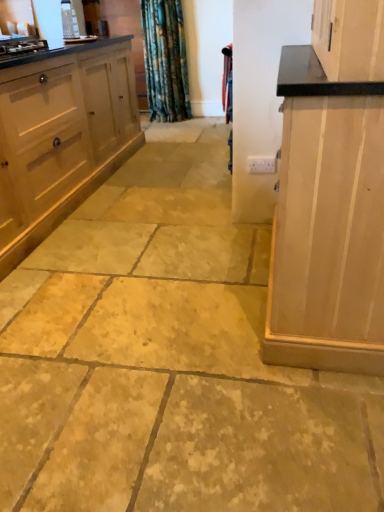
Identify the location of light wood cabinet at right, which ranks as the 1th cabinetry in right-to-left order. (327, 222).

Find the location of `white wood cabinet at left, positioned as the 1th cabinetry in left-to-right order`. white wood cabinet at left, positioned as the 1th cabinetry in left-to-right order is located at coordinates (61, 139).

In order to click on velvet-like red curtain at center in this screenshot , I will do `click(227, 82)`.

Where is `light wood cabinet at right, arranged as the 2th cabinetry when viewed from the left`? This screenshot has width=384, height=512. light wood cabinet at right, arranged as the 2th cabinetry when viewed from the left is located at coordinates (327, 222).

From the image's perspective, relative to white wood cabinet at left, marked as the second cabinetry in a right-to-left arrangement, is velvet-like red curtain at center above or below?

Clearly, from the image's perspective, velvet-like red curtain at center is above white wood cabinet at left, marked as the second cabinetry in a right-to-left arrangement.

From a real-world perspective, who is located higher, velvet-like red curtain at center or white wood cabinet at left, positioned as the 1th cabinetry in left-to-right order?

velvet-like red curtain at center.

Is velvet-like red curtain at center outside of white wood cabinet at left, marked as the second cabinetry in a right-to-left arrangement?

velvet-like red curtain at center lies outside white wood cabinet at left, marked as the second cabinetry in a right-to-left arrangement,'s area.

Considering the points (2, 257) and (229, 77), which point is behind, point (2, 257) or point (229, 77)?

The point (229, 77) is farther.

From a real-world perspective, is white wood cabinet at left, marked as the second cabinetry in a right-to-left arrangement, positioned above or below velvet-like red curtain at center?

white wood cabinet at left, marked as the second cabinetry in a right-to-left arrangement, is below velvet-like red curtain at center.

Is white wood cabinet at left, positioned as the 1th cabinetry in left-to-right order, inside the boundaries of velvet-like red curtain at center, or outside?

white wood cabinet at left, positioned as the 1th cabinetry in left-to-right order, exists outside the volume of velvet-like red curtain at center.

Can you confirm if white wood cabinet at left, positioned as the 1th cabinetry in left-to-right order, is shorter than velvet-like red curtain at center?

Incorrect, the height of white wood cabinet at left, positioned as the 1th cabinetry in left-to-right order, does not fall short of that of velvet-like red curtain at center.

Considering the sizes of velvet-like red curtain at center and light wood cabinet at right, which ranks as the 1th cabinetry in right-to-left order, in the image, is velvet-like red curtain at center taller or shorter than light wood cabinet at right, which ranks as the 1th cabinetry in right-to-left order,?

velvet-like red curtain at center is shorter than light wood cabinet at right, which ranks as the 1th cabinetry in right-to-left order.

From the image's perspective, is velvet-like red curtain at center positioned above or below light wood cabinet at right, arranged as the 2th cabinetry when viewed from the left?

Clearly, from the image's perspective, velvet-like red curtain at center is above light wood cabinet at right, arranged as the 2th cabinetry when viewed from the left.

Can you confirm if velvet-like red curtain at center is wider than light wood cabinet at right, arranged as the 2th cabinetry when viewed from the left?

In fact, velvet-like red curtain at center might be narrower than light wood cabinet at right, arranged as the 2th cabinetry when viewed from the left.

Considering the sizes of objects light wood cabinet at right, which ranks as the 1th cabinetry in right-to-left order, and white wood cabinet at left, marked as the second cabinetry in a right-to-left arrangement, in the image provided, who is taller, light wood cabinet at right, which ranks as the 1th cabinetry in right-to-left order, or white wood cabinet at left, marked as the second cabinetry in a right-to-left arrangement,?

light wood cabinet at right, which ranks as the 1th cabinetry in right-to-left order.

Which point is more distant from viewer, [354,274] or [9,186]?

The point [9,186] is farther.

Identify the location of cabinetry on the left of light wood cabinet at right, arranged as the 2th cabinetry when viewed from the left. (61, 139).

What's the angular difference between light wood cabinet at right, which ranks as the 1th cabinetry in right-to-left order, and white wood cabinet at left, marked as the second cabinetry in a right-to-left arrangement,'s facing directions?

light wood cabinet at right, which ranks as the 1th cabinetry in right-to-left order, and white wood cabinet at left, marked as the second cabinetry in a right-to-left arrangement, are facing 180 degrees away from each other.

Which object is more forward, white wood cabinet at left, marked as the second cabinetry in a right-to-left arrangement, or light wood cabinet at right, arranged as the 2th cabinetry when viewed from the left?

light wood cabinet at right, arranged as the 2th cabinetry when viewed from the left, is closer to the camera.

Find the location of a particular element. This screenshot has height=512, width=384. cabinetry that is under the light wood cabinet at right, which ranks as the 1th cabinetry in right-to-left order (from a real-world perspective) is located at coordinates (61, 139).

Does white wood cabinet at left, marked as the second cabinetry in a right-to-left arrangement, appear on the right side of light wood cabinet at right, arranged as the 2th cabinetry when viewed from the left?

In fact, white wood cabinet at left, marked as the second cabinetry in a right-to-left arrangement, is to the left of light wood cabinet at right, arranged as the 2th cabinetry when viewed from the left.

Considering the relative sizes of white wood cabinet at left, positioned as the 1th cabinetry in left-to-right order, and light wood cabinet at right, which ranks as the 1th cabinetry in right-to-left order, in the image provided, is white wood cabinet at left, positioned as the 1th cabinetry in left-to-right order, bigger than light wood cabinet at right, which ranks as the 1th cabinetry in right-to-left order,?

Yes.

From the image's perspective, is light wood cabinet at right, arranged as the 2th cabinetry when viewed from the left, located above or below velvet-like red curtain at center?

From the image's perspective, light wood cabinet at right, arranged as the 2th cabinetry when viewed from the left, appears below velvet-like red curtain at center.

There is a light wood cabinet at right, arranged as the 2th cabinetry when viewed from the left. Find the location of `curtain above it (from a real-world perspective)`. curtain above it (from a real-world perspective) is located at coordinates (227, 82).

From a real-world perspective, which is physically below, light wood cabinet at right, arranged as the 2th cabinetry when viewed from the left, or velvet-like red curtain at center?

From a 3D spatial view, light wood cabinet at right, arranged as the 2th cabinetry when viewed from the left, is below.

Find the location of a particular element. The image size is (384, 512). curtain that appears on the right of white wood cabinet at left, positioned as the 1th cabinetry in left-to-right order is located at coordinates (227, 82).

The width and height of the screenshot is (384, 512). I want to click on curtain above the white wood cabinet at left, positioned as the 1th cabinetry in left-to-right order (from the image's perspective), so click(227, 82).

Considering their positions, is white wood cabinet at left, positioned as the 1th cabinetry in left-to-right order, positioned further to velvet-like red curtain at center than light wood cabinet at right, which ranks as the 1th cabinetry in right-to-left order?

The object further to velvet-like red curtain at center is light wood cabinet at right, which ranks as the 1th cabinetry in right-to-left order.

When comparing their distances from white wood cabinet at left, marked as the second cabinetry in a right-to-left arrangement, does velvet-like red curtain at center or light wood cabinet at right, arranged as the 2th cabinetry when viewed from the left, seem further?

light wood cabinet at right, arranged as the 2th cabinetry when viewed from the left, is positioned further to the anchor white wood cabinet at left, marked as the second cabinetry in a right-to-left arrangement.

Which object lies nearer to the anchor point velvet-like red curtain at center, light wood cabinet at right, which ranks as the 1th cabinetry in right-to-left order, or white wood cabinet at left, marked as the second cabinetry in a right-to-left arrangement?

white wood cabinet at left, marked as the second cabinetry in a right-to-left arrangement.

Which object lies further to the anchor point light wood cabinet at right, which ranks as the 1th cabinetry in right-to-left order, white wood cabinet at left, marked as the second cabinetry in a right-to-left arrangement, or velvet-like red curtain at center?

white wood cabinet at left, marked as the second cabinetry in a right-to-left arrangement, is positioned further to the anchor light wood cabinet at right, which ranks as the 1th cabinetry in right-to-left order.

Considering their positions, is light wood cabinet at right, arranged as the 2th cabinetry when viewed from the left, positioned closer to white wood cabinet at left, marked as the second cabinetry in a right-to-left arrangement, than velvet-like red curtain at center?

Based on the image, velvet-like red curtain at center appears to be nearer to white wood cabinet at left, marked as the second cabinetry in a right-to-left arrangement.

Considering their positions, is velvet-like red curtain at center positioned further to light wood cabinet at right, which ranks as the 1th cabinetry in right-to-left order, than white wood cabinet at left, marked as the second cabinetry in a right-to-left arrangement?

Based on the image, white wood cabinet at left, marked as the second cabinetry in a right-to-left arrangement, appears to be further to light wood cabinet at right, which ranks as the 1th cabinetry in right-to-left order.

This screenshot has height=512, width=384. Find the location of `curtain between white wood cabinet at left, marked as the second cabinetry in a right-to-left arrangement, and light wood cabinet at right, which ranks as the 1th cabinetry in right-to-left order`. curtain between white wood cabinet at left, marked as the second cabinetry in a right-to-left arrangement, and light wood cabinet at right, which ranks as the 1th cabinetry in right-to-left order is located at coordinates (227, 82).